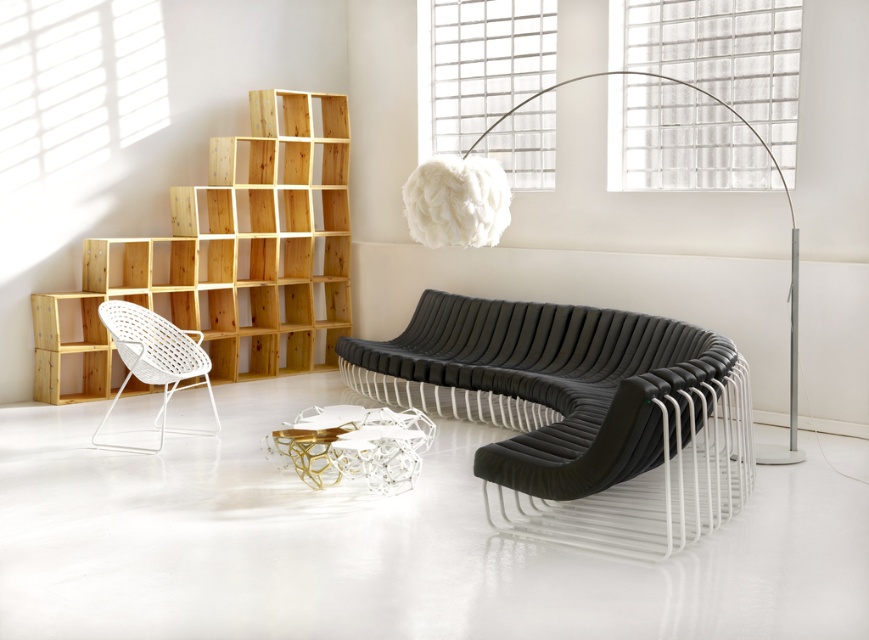
Is black leather daybed at center in front of natural wood bookshelf at left?

Yes, it is in front of natural wood bookshelf at left.

The width and height of the screenshot is (869, 640). What do you see at coordinates (578, 413) in the screenshot? I see `black leather daybed at center` at bounding box center [578, 413].

Who is more forward, (495,360) or (85,253)?

Point (495,360) is more forward.

I want to click on black leather daybed at center, so click(x=578, y=413).

Between natural wood bookshelf at left and white woven armchair at left, which one has less height?

With less height is white woven armchair at left.

Does natural wood bookshelf at left have a larger size compared to white woven armchair at left?

Correct, natural wood bookshelf at left is larger in size than white woven armchair at left.

Is point (323, 180) farther from viewer compared to point (204, 369)?

That is True.

The image size is (869, 640). In order to click on natural wood bookshelf at left in this screenshot , I will do `click(226, 257)`.

Does black leather daybed at center appear on the right side of white woven armchair at left?

Indeed, black leather daybed at center is positioned on the right side of white woven armchair at left.

Is point (559, 397) behind point (131, 307)?

That is False.

Does point (724, 342) lie behind point (117, 448)?

No, it is in front of (117, 448).

The image size is (869, 640). I want to click on black leather daybed at center, so click(x=578, y=413).